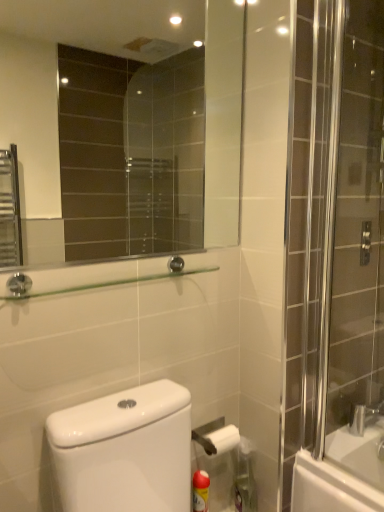
Question: From the image's perspective, is clear glass shower door at right above or below clear glass shelf at upper center?

Choices:
 (A) below
 (B) above

Answer: (B)

Question: Considering the positions of point (359, 203) and point (38, 294), is point (359, 203) closer or farther from the camera than point (38, 294)?

Choices:
 (A) closer
 (B) farther

Answer: (B)

Question: Which of these objects is positioned farthest from the yellow plastic spray can at lower right, which is counted as the second cleaning product, starting from the left?

Choices:
 (A) yellow matte cleaning product at lower center, the 2th cleaning product viewed from the right
 (B) clear glass shelf at upper center
 (C) clear glass shower door at right
 (D) clear glass mirror at upper center

Answer: (D)

Question: Which object is the closest to the clear glass shower door at right?

Choices:
 (A) clear glass shelf at upper center
 (B) clear glass mirror at upper center
 (C) yellow plastic spray can at lower right, positioned as the 1th cleaning product in right-to-left order
 (D) yellow matte cleaning product at lower center, the 2th cleaning product viewed from the right

Answer: (A)